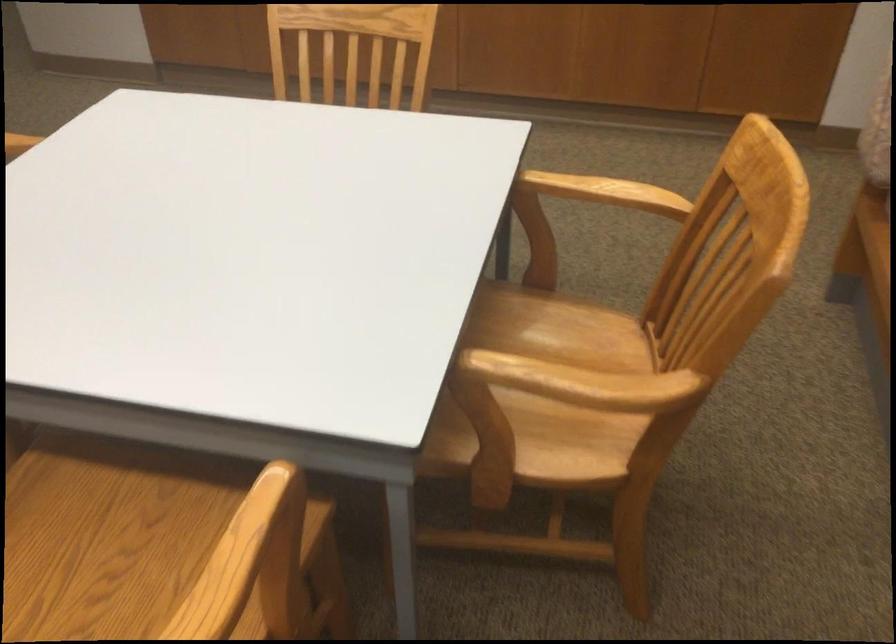
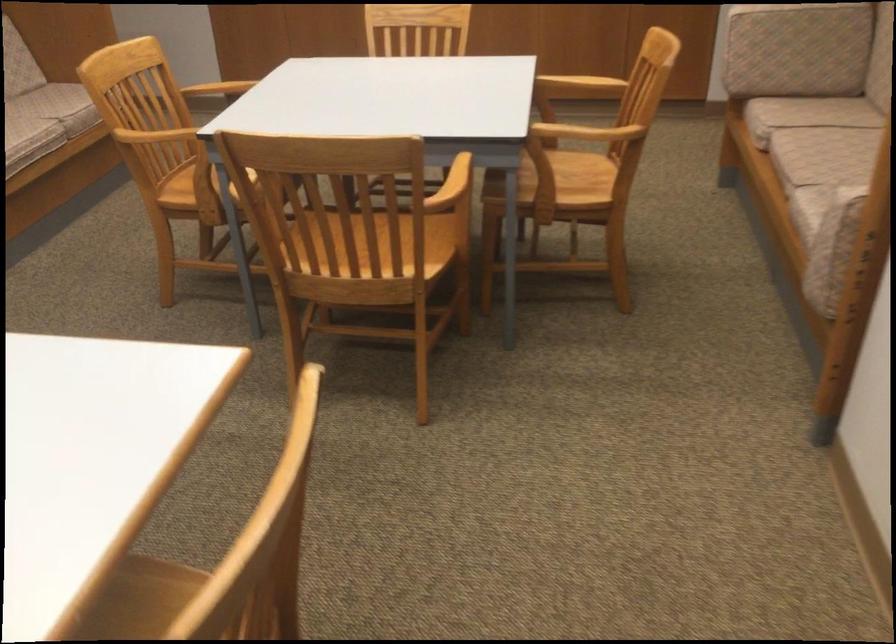
Find the pixel in the second image that matches (627,99) in the first image.

(580, 84)